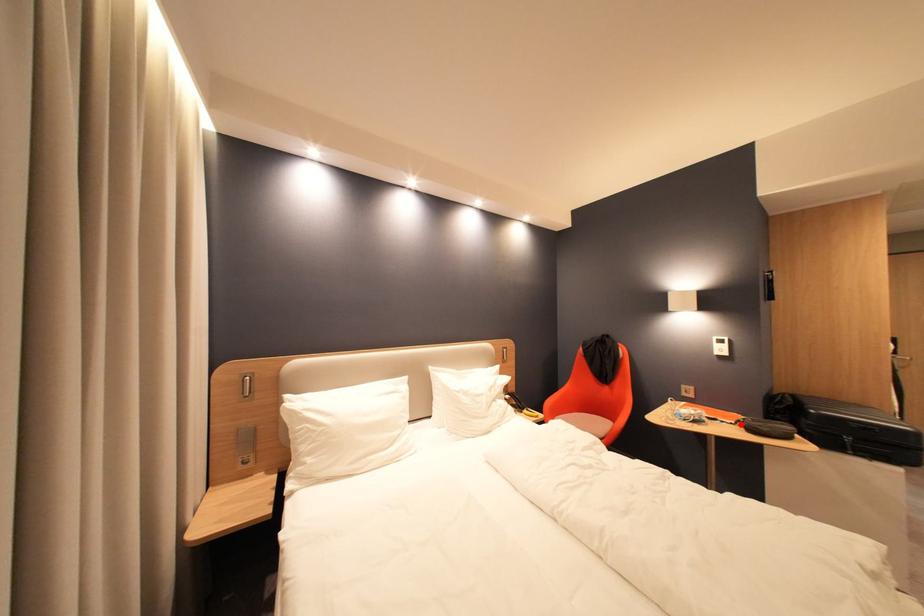
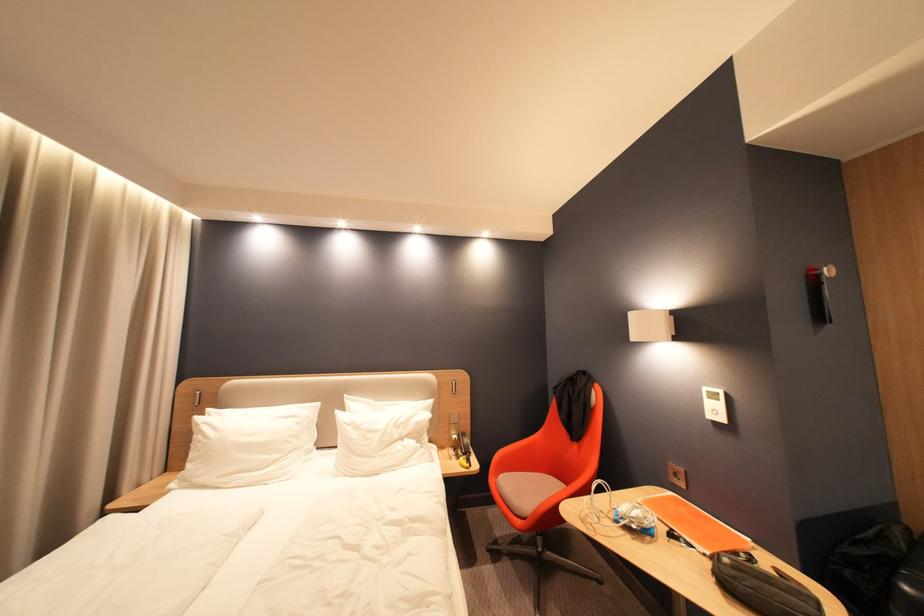
Where in the second image is the point corresponding to the highlighted location from the first image?

(714, 556)